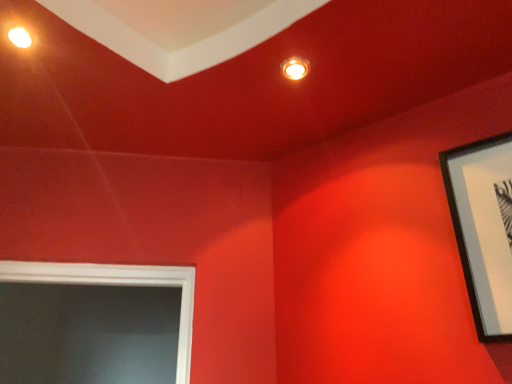
What do you see at coordinates (295, 68) in the screenshot?
I see `matte orange light fixture at upper center` at bounding box center [295, 68].

Locate an element on the screen. matte orange light fixture at upper center is located at coordinates (295, 68).

Measure the distance between point (297, 60) and camera.

Point (297, 60) is 1.21 meters from camera.

The width and height of the screenshot is (512, 384). What do you see at coordinates (484, 228) in the screenshot?
I see `black matte picture frame at upper right` at bounding box center [484, 228].

Identify the location of black matte picture frame at upper right. (484, 228).

You are a GUI agent. You are given a task and a screenshot of the screen. Output one action in this format:
    pyautogui.click(x=<x>, y=<y>)
    Task: Click on the matte orange light fixture at upper center
    
    Given the screenshot: What is the action you would take?
    pyautogui.click(x=295, y=68)

Does black matte picture frame at upper right appear on the right side of matte orange light fixture at upper center?

Correct, you'll find black matte picture frame at upper right to the right of matte orange light fixture at upper center.

Is black matte picture frame at upper right positioned before matte orange light fixture at upper center?

Yes, black matte picture frame at upper right is closer to the camera.

Is point (464, 166) behind point (282, 69)?

No, it is not.

From the image's perspective, is black matte picture frame at upper right located above matte orange light fixture at upper center?

Actually, black matte picture frame at upper right appears below matte orange light fixture at upper center in the image.

From a real-world perspective, is black matte picture frame at upper right physically located above or below matte orange light fixture at upper center?

Clearly, from a real-world perspective, black matte picture frame at upper right is below matte orange light fixture at upper center.

Which of these two, black matte picture frame at upper right or matte orange light fixture at upper center, is wider?

matte orange light fixture at upper center.

Which of these two, black matte picture frame at upper right or matte orange light fixture at upper center, stands taller?

Standing taller between the two is black matte picture frame at upper right.

Consider the image. Looking at the image, does black matte picture frame at upper right seem bigger or smaller compared to matte orange light fixture at upper center?

In the image, black matte picture frame at upper right appears to be larger than matte orange light fixture at upper center.

Consider the image. Is black matte picture frame at upper right surrounding matte orange light fixture at upper center?

No, matte orange light fixture at upper center is located outside of black matte picture frame at upper right.

Is black matte picture frame at upper right next to matte orange light fixture at upper center?

black matte picture frame at upper right and matte orange light fixture at upper center are clearly separated.

Is black matte picture frame at upper right aimed at matte orange light fixture at upper center?

No.

What's the angular difference between black matte picture frame at upper right and matte orange light fixture at upper center's facing directions?

There is a 133-degree angle between the facing directions of black matte picture frame at upper right and matte orange light fixture at upper center.

At what (x,y) coordinates should I click in order to perform the action: click on picture frame in front of the matte orange light fixture at upper center. Please return your answer as a coordinate pair (x, y). Looking at the image, I should click on (484, 228).

Considering the positions of objects matte orange light fixture at upper center and black matte picture frame at upper right in the image provided, who is more to the right, matte orange light fixture at upper center or black matte picture frame at upper right?

black matte picture frame at upper right.

Is the position of matte orange light fixture at upper center less distant than that of black matte picture frame at upper right?

No, it is not.

Is point (302, 77) behind point (468, 144)?

Yes, point (302, 77) is behind point (468, 144).

From the image's perspective, is matte orange light fixture at upper center on black matte picture frame at upper right?

Yes, from the image's perspective, matte orange light fixture at upper center is above black matte picture frame at upper right.

From a real-world perspective, which is physically above, matte orange light fixture at upper center or black matte picture frame at upper right?

matte orange light fixture at upper center is physically above.

Between matte orange light fixture at upper center and black matte picture frame at upper right, which one has smaller width?

Thinner between the two is black matte picture frame at upper right.

Which of these two, matte orange light fixture at upper center or black matte picture frame at upper right, stands shorter?

matte orange light fixture at upper center is shorter.

Looking at the image, does matte orange light fixture at upper center seem bigger or smaller compared to black matte picture frame at upper right?

Considering their sizes, matte orange light fixture at upper center takes up less space than black matte picture frame at upper right.

Is matte orange light fixture at upper center spatially inside black matte picture frame at upper right, or outside of it?

matte orange light fixture at upper center exists outside the volume of black matte picture frame at upper right.

In the scene shown: Is matte orange light fixture at upper center next to black matte picture frame at upper right and touching it?

There is a gap between matte orange light fixture at upper center and black matte picture frame at upper right.

Based on the photo, is matte orange light fixture at upper center aimed at black matte picture frame at upper right?

No.

Identify the location of lighting on the left of black matte picture frame at upper right. This screenshot has width=512, height=384. (295, 68).

Where is `picture frame to the right of matte orange light fixture at upper center`? picture frame to the right of matte orange light fixture at upper center is located at coordinates (484, 228).

Where is `picture frame that appears below the matte orange light fixture at upper center (from the image's perspective)`? Image resolution: width=512 pixels, height=384 pixels. picture frame that appears below the matte orange light fixture at upper center (from the image's perspective) is located at coordinates (484, 228).